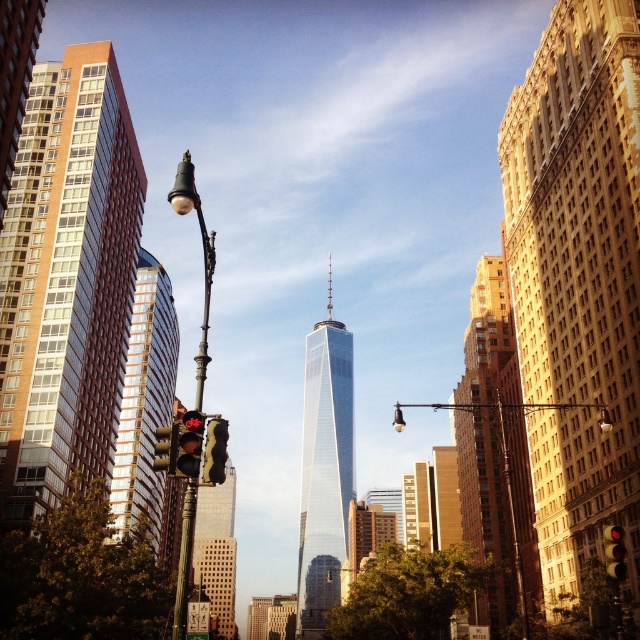
You are a pedestrian standing at the street corner and looking towards the glassy reflective skyscraper at left and the yellow matte traffic light at center. Which object is closer to the ground?

The yellow matte traffic light at center is closer to the ground because the glassy reflective skyscraper at left is positioned under it.

You are standing at the street corner with the red bicycle traffic light and want to take a photo of the gold brick building at center. Where should you position yourself to capture the building in the frame?

To capture the gold brick building at center in your photo, position yourself at the street corner with the red bicycle traffic light, as the building is located at the center of the scene, specifically at coordinates 0.702 on the x and 0.772 on the y axis.

You are a pedestrian standing at the street corner and see the glassy reflective skyscraper at left and the matte black streetlight at left. Which object is closer to you?

The glassy reflective skyscraper at left is closer to you because the matte black streetlight at left is behind it.